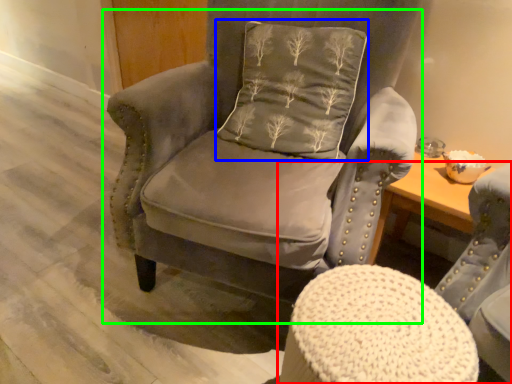
Question: Which object is the farthest from chair (highlighted by a red box)? Choose among these: pillow (highlighted by a blue box) or chair (highlighted by a green box).

Choices:
 (A) pillow
 (B) chair

Answer: (A)